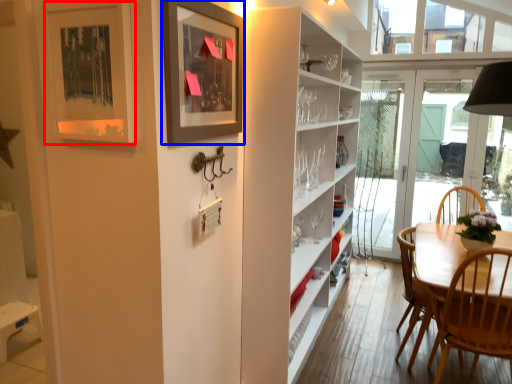
Question: Which of the following is the closest to the observer, picture frame (highlighted by a red box) or picture frame (highlighted by a blue box)?

Choices:
 (A) picture frame
 (B) picture frame

Answer: (A)